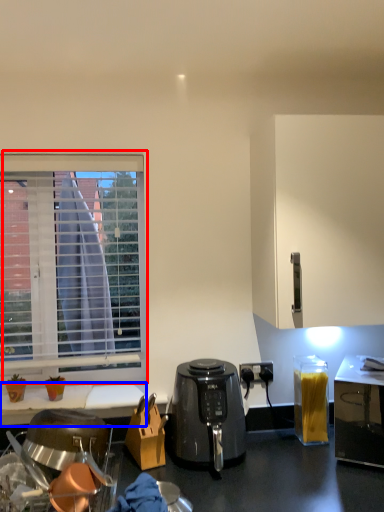
Question: Among these objects, which one is farthest to the camera, window (highlighted by a red box) or desk (highlighted by a blue box)?

Choices:
 (A) window
 (B) desk

Answer: (A)